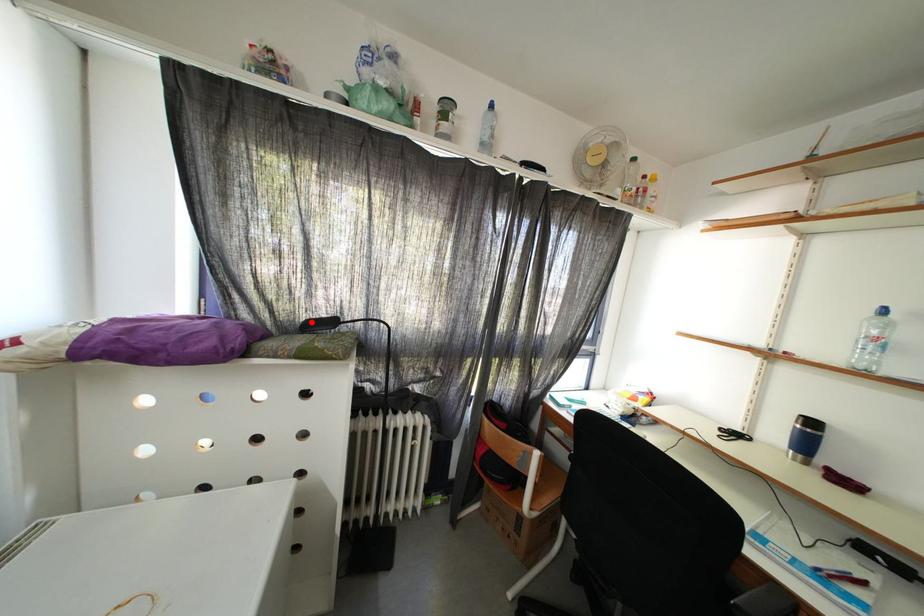
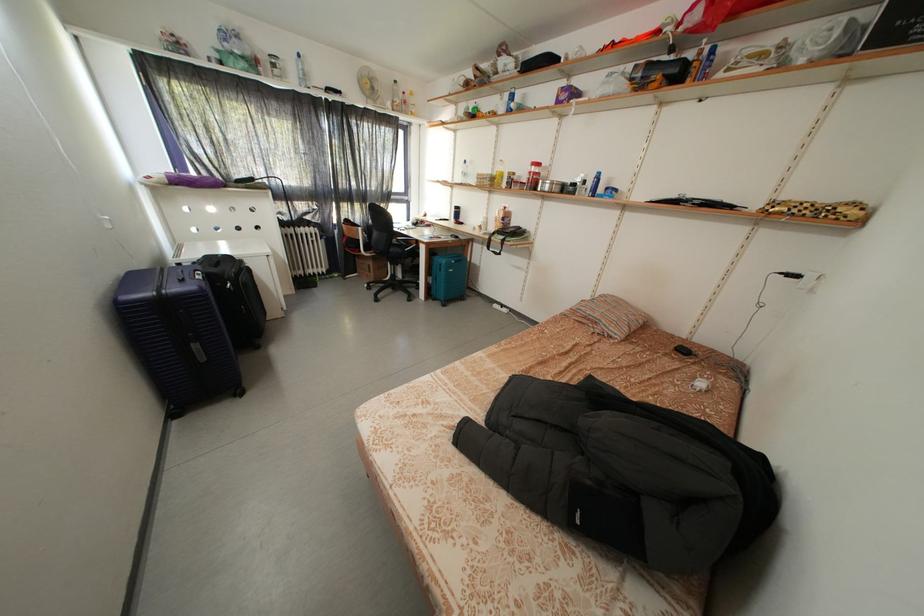
In the second image, find the point that corresponds to the highlighted location in the first image.

(242, 182)